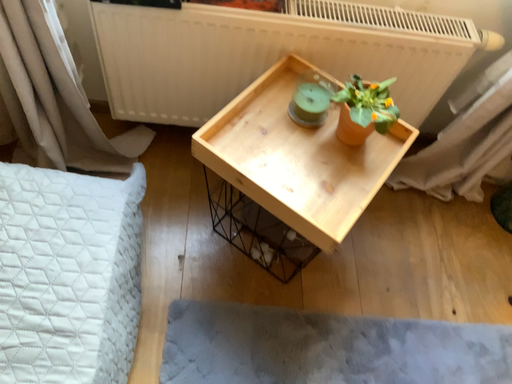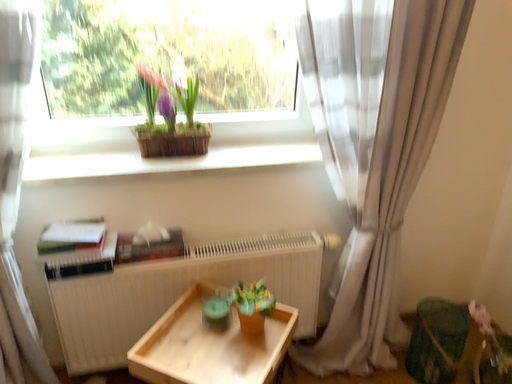
Question: How did the camera likely rotate when shooting the video?

Choices:
 (A) rotated downward
 (B) rotated upward

Answer: (B)